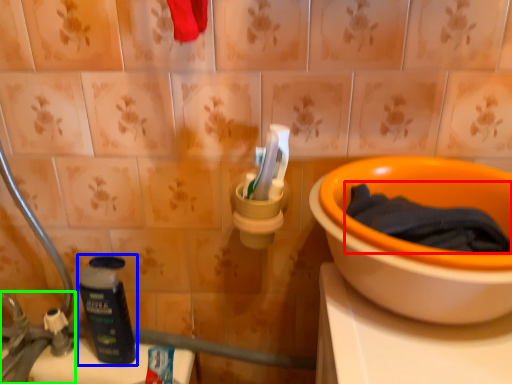
Question: Which object is positioned closest to bath towel (highlighted by a red box)? Select from bottle (highlighted by a blue box) and faucet (highlighted by a green box).

Choices:
 (A) bottle
 (B) faucet

Answer: (A)